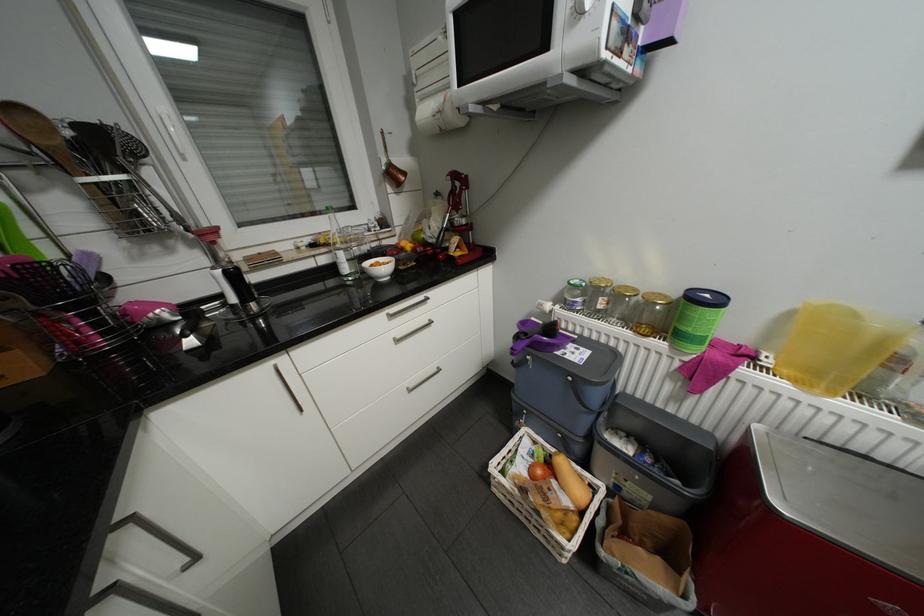
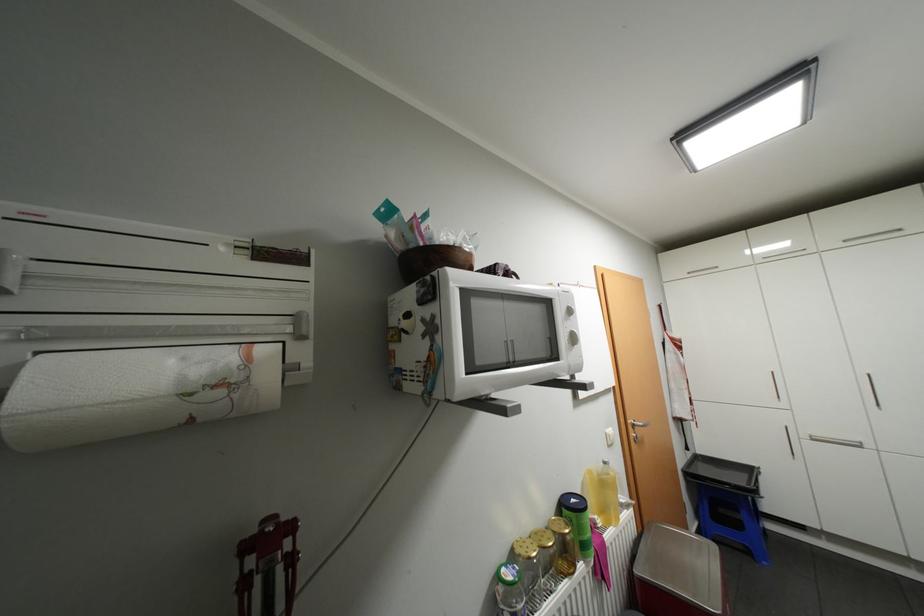
Locate, in the second image, the point that corresponds to (714,294) in the first image.

(580, 499)